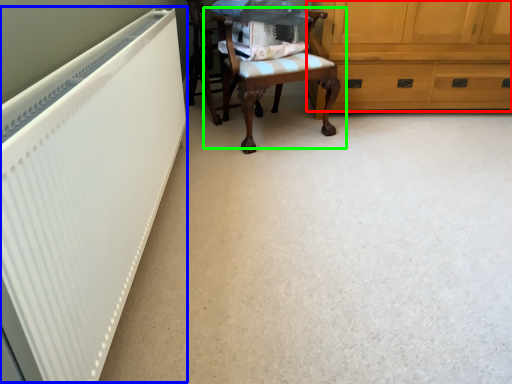
Question: Estimate the real-world distances between objects in this image. Which object is closer to cabinetry (highlighted by a red box), radiator (highlighted by a blue box) or chair (highlighted by a green box)?

Choices:
 (A) radiator
 (B) chair

Answer: (B)